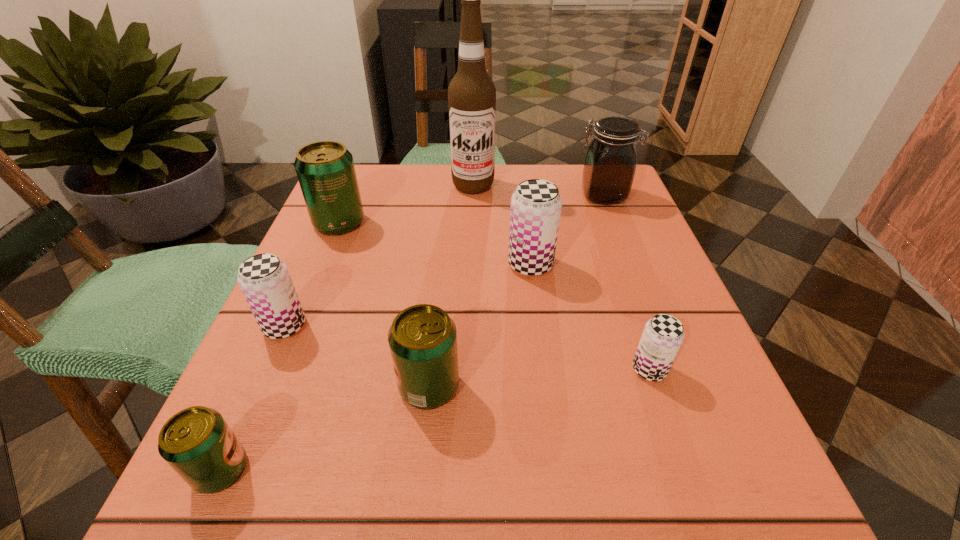
Locate an element on the screen. Image resolution: width=960 pixels, height=540 pixels. object that is at the far left corner is located at coordinates (325, 169).

At what (x,y) coordinates should I click in order to perform the action: click on object that is at the near left corner. Please return your answer as a coordinate pair (x, y). Image resolution: width=960 pixels, height=540 pixels. Looking at the image, I should click on (197, 443).

Identify the location of object present at the far right corner. This screenshot has height=540, width=960. (610, 162).

You are a GUI agent. You are given a task and a screenshot of the screen. Output one action in this format:
    pyautogui.click(x=<x>, y=<y>)
    Task: Click on the vacant space at the far edge of the desktop
    The image size is (960, 540).
    Given the screenshot: What is the action you would take?
    (x=450, y=166)

This screenshot has height=540, width=960. I want to click on vacant region at the left edge of the desktop, so click(341, 275).

Where is `free space at the right edge of the desktop`? free space at the right edge of the desktop is located at coordinates (634, 443).

In the image, there is a desktop. Identify the location of free space at the far left corner. (394, 212).

Find the location of a particular element. Image resolution: width=960 pixels, height=540 pixels. free space at the near left corner of the desktop is located at coordinates (260, 514).

The height and width of the screenshot is (540, 960). I want to click on free region at the near right corner of the desktop, so click(677, 469).

The height and width of the screenshot is (540, 960). Find the location of `blank region between the alcohol and the farthest green beer can`. blank region between the alcohol and the farthest green beer can is located at coordinates (406, 204).